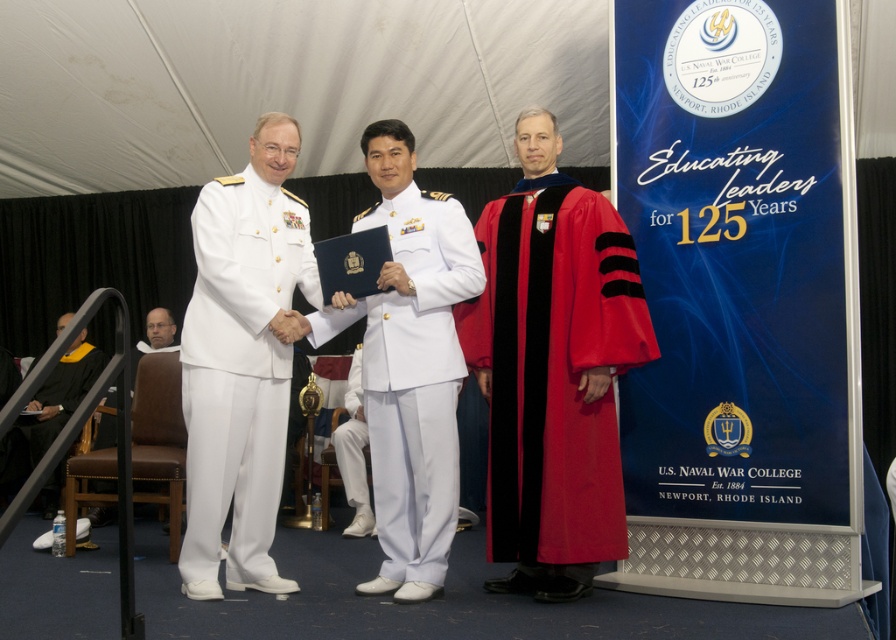
Can you confirm if white matte uniform at center is positioned to the right of white matte pants at center?

Indeed, white matte uniform at center is positioned on the right side of white matte pants at center.

Can you confirm if white matte uniform at center is positioned above white matte pants at center?

Correct, white matte uniform at center is located above white matte pants at center.

You are a GUI agent. You are given a task and a screenshot of the screen. Output one action in this format:
    pyautogui.click(x=<x>, y=<y>)
    Task: Click on the white matte uniform at center
    The width and height of the screenshot is (896, 640).
    Given the screenshot: What is the action you would take?
    pyautogui.click(x=412, y=380)

Identify the location of white matte uniform at center. (412, 380).

Is shiny red graduation gown at right below white matte pants at center?

Incorrect, shiny red graduation gown at right is not positioned below white matte pants at center.

Is point (599, 256) positioned behind point (352, 428)?

No, it is in front of (352, 428).

Is point (517, 508) in front of point (347, 396)?

Yes, it is.

You are a GUI agent. You are given a task and a screenshot of the screen. Output one action in this format:
    pyautogui.click(x=<x>, y=<y>)
    Task: Click on the shiny red graduation gown at right
    The image size is (896, 640).
    Given the screenshot: What is the action you would take?
    pyautogui.click(x=554, y=369)

The image size is (896, 640). What do you see at coordinates (239, 374) in the screenshot?
I see `white matte uniform at left` at bounding box center [239, 374].

Does white matte uniform at left have a lesser width compared to black matte graduation gown at lower left?

No.

Is point (228, 564) positioned in front of point (32, 420)?

Yes, point (228, 564) is in front of point (32, 420).

This screenshot has height=640, width=896. Identify the location of white matte uniform at left. (239, 374).